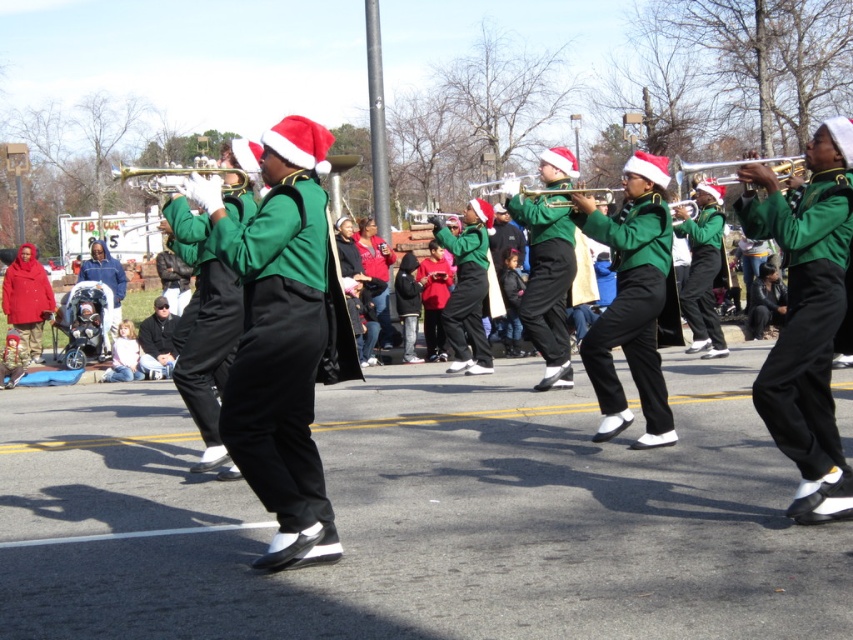
Question: Does green matte uniform at center have a greater width compared to gold metallic trumpet at center?

Choices:
 (A) no
 (B) yes

Answer: (A)

Question: Which of the following is the farthest from the observer?

Choices:
 (A) (430, 212)
 (B) (669, 266)

Answer: (A)

Question: Among these objects, which one is farthest from the camera?

Choices:
 (A) matte green trumpet at center
 (B) matte red coat at left
 (C) green matte jacket at center

Answer: (B)

Question: Does matte brass trumpet at center have a smaller size compared to brass trumpet at center?

Choices:
 (A) yes
 (B) no

Answer: (B)

Question: Which point is closer to the camera?

Choices:
 (A) (709, 177)
 (B) (229, 189)

Answer: (B)

Question: Does matte red coat at left have a greater width compared to matte green trumpet at center?

Choices:
 (A) no
 (B) yes

Answer: (A)